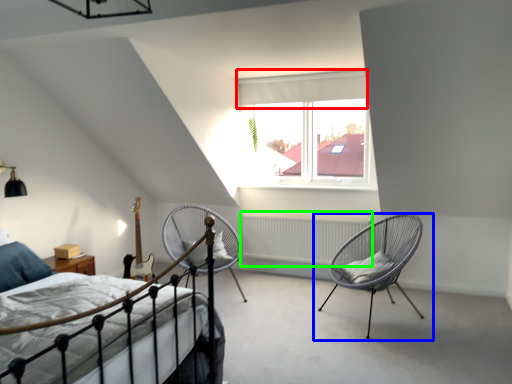
Question: Estimate the real-world distances between objects in this image. Which object is farther from curtain (highlighted by a red box), chair (highlighted by a blue box) or radiator (highlighted by a green box)?

Choices:
 (A) chair
 (B) radiator

Answer: (A)